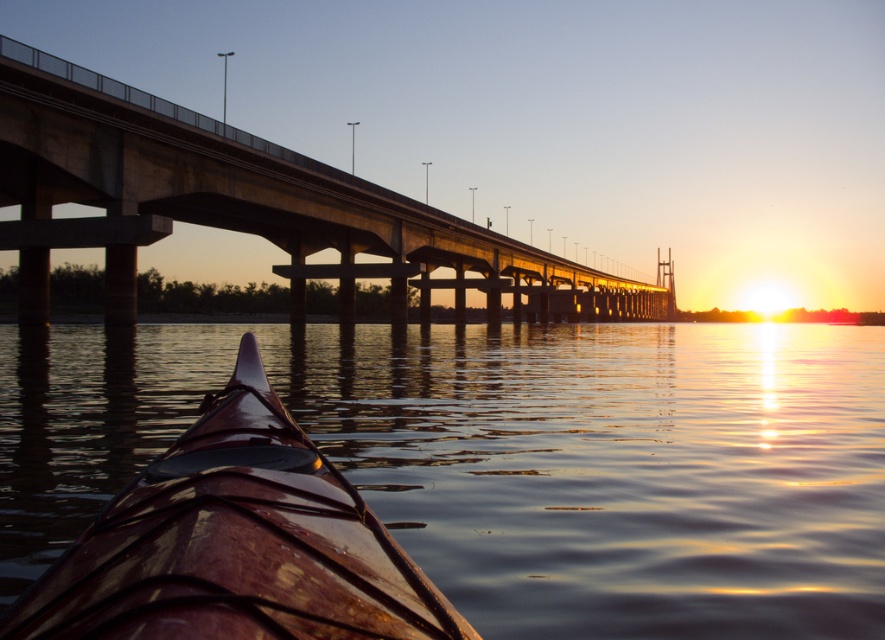
Between concrete bridge at center and glossy brown kayak at lower left, which one has less height?

glossy brown kayak at lower left

Between point (117, 307) and point (73, 570), which one is positioned in front?

Point (73, 570) is in front.

Where is `concrete bridge at center`? concrete bridge at center is located at coordinates (244, 204).